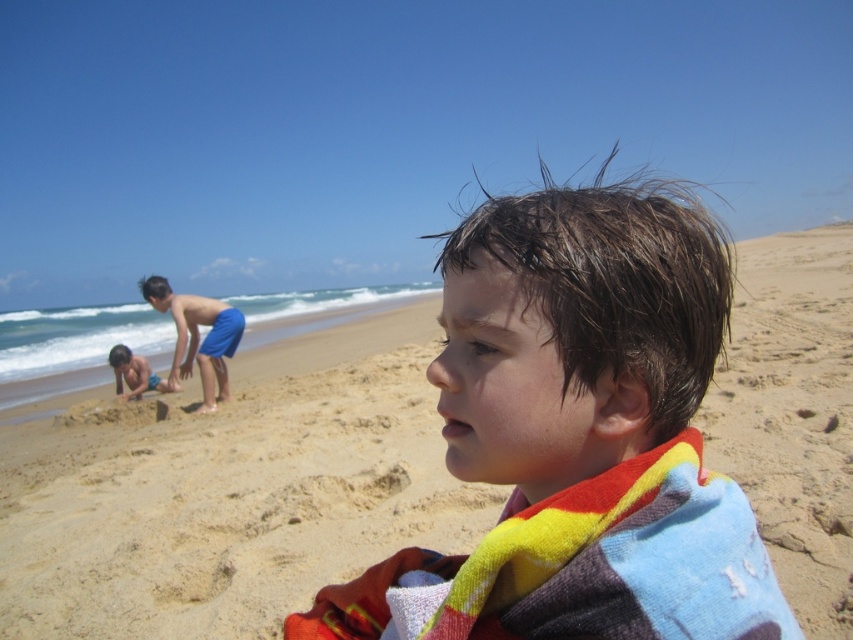
Question: Which object is farther from the camera taking this photo?

Choices:
 (A) blue shorts at lower left
 (B) wet hair towel at center

Answer: (A)

Question: Is wet hair towel at center thinner than blue shorts at lower left?

Choices:
 (A) yes
 (B) no

Answer: (A)

Question: From the image, what is the correct spatial relationship of wet hair towel at center in relation to blue shorts at center?

Choices:
 (A) above
 (B) below

Answer: (B)

Question: Which point is farther from the camera taking this photo?

Choices:
 (A) (122, 387)
 (B) (227, 340)
 (C) (631, 362)

Answer: (A)

Question: Is wet hair towel at center positioned before blue shorts at center?

Choices:
 (A) yes
 (B) no

Answer: (A)

Question: Among these objects, which one is nearest to the camera?

Choices:
 (A) blue shorts at lower left
 (B) blue shorts at center

Answer: (B)